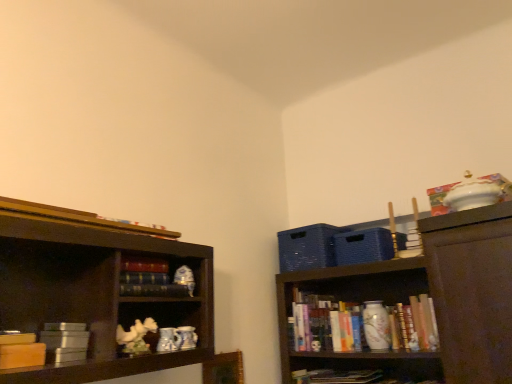
Question: Would you say black matte bookshelf at center, which is counted as the 2th book, starting from the right, contains metallic silver book at lower left, which is the 3th book in front-to-back order?

Choices:
 (A) no
 (B) yes

Answer: (A)

Question: Considering the relative sizes of black matte bookshelf at center, which is counted as the 2th book, starting from the right, and metallic silver book at lower left, which is the 3th book in front-to-back order, in the image provided, is black matte bookshelf at center, which is counted as the 2th book, starting from the right, thinner than metallic silver book at lower left, which is the 3th book in front-to-back order,?

Choices:
 (A) yes
 (B) no

Answer: (A)

Question: Is black matte bookshelf at center, the fourth book in the bottom-to-top sequence, facing towards metallic silver book at lower left, which ranks as the 4th book in top-to-bottom order?

Choices:
 (A) no
 (B) yes

Answer: (A)

Question: Can you confirm if black matte bookshelf at center, which is counted as the 2th book, starting from the right, is positioned to the right of metallic silver book at lower left, marked as the 3th book in a back-to-front arrangement?

Choices:
 (A) no
 (B) yes

Answer: (B)

Question: Is black matte bookshelf at center, which is counted as the 2th book, starting from the back, at the left side of metallic silver book at lower left, the 4th book when ordered from right to left?

Choices:
 (A) no
 (B) yes

Answer: (A)

Question: Is hardcover book at upper left, which is the first book from top to bottom, spatially inside metallic silver book at lower left, which ranks as the 4th book in top-to-bottom order, or outside of it?

Choices:
 (A) outside
 (B) inside

Answer: (A)

Question: In the image, is hardcover book at upper left, which is counted as the 3th book, starting from the left, on the left side or the right side of metallic silver book at lower left, marked as the 2th book in a bottom-to-top arrangement?

Choices:
 (A) left
 (B) right

Answer: (B)

Question: Is hardcover book at upper left, the first book from the front, wider or thinner than metallic silver book at lower left, the 4th book when ordered from right to left?

Choices:
 (A) wide
 (B) thin

Answer: (B)

Question: Is point (44, 208) positioned closer to the camera than point (73, 340)?

Choices:
 (A) farther
 (B) closer

Answer: (B)

Question: From a real-world perspective, is metallic silver book at lower left, the 4th book when ordered from right to left, physically located above or below matte yellow book at left, placed as the second book when sorted from front to back?

Choices:
 (A) above
 (B) below

Answer: (A)

Question: From the image's perspective, relative to matte yellow book at left, placed as the second book when sorted from front to back, is metallic silver book at lower left, marked as the 3th book in a back-to-front arrangement, above or below?

Choices:
 (A) below
 (B) above

Answer: (A)

Question: Is point click(x=80, y=342) closer or farther from the camera than point click(x=14, y=339)?

Choices:
 (A) farther
 (B) closer

Answer: (A)

Question: Is metallic silver book at lower left, which ranks as the 4th book in top-to-bottom order, inside the boundaries of matte yellow book at left, placed as the third book when sorted from bottom to top, or outside?

Choices:
 (A) inside
 (B) outside

Answer: (B)

Question: From a real-world perspective, is black matte bookshelf at center, the fourth book in the bottom-to-top sequence, above or below hardcover book at upper left, marked as the third book in a right-to-left arrangement?

Choices:
 (A) above
 (B) below

Answer: (B)

Question: Is point (158, 294) closer or farther from the camera than point (168, 231)?

Choices:
 (A) closer
 (B) farther

Answer: (A)